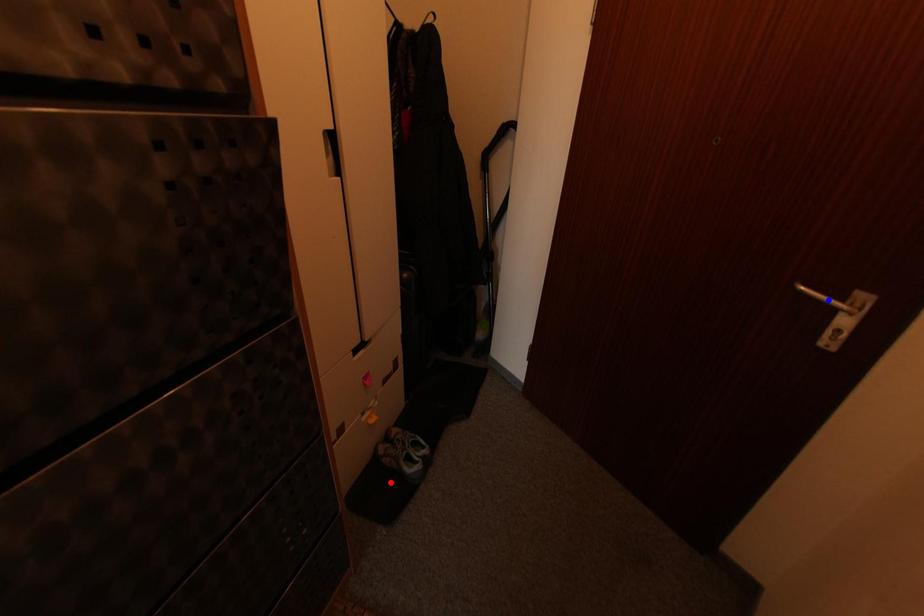
Question: In the image, two points are highlighted. Which point is nearer to the camera? Reply with the corresponding letter.

Choices:
 (A) blue point
 (B) red point

Answer: (A)